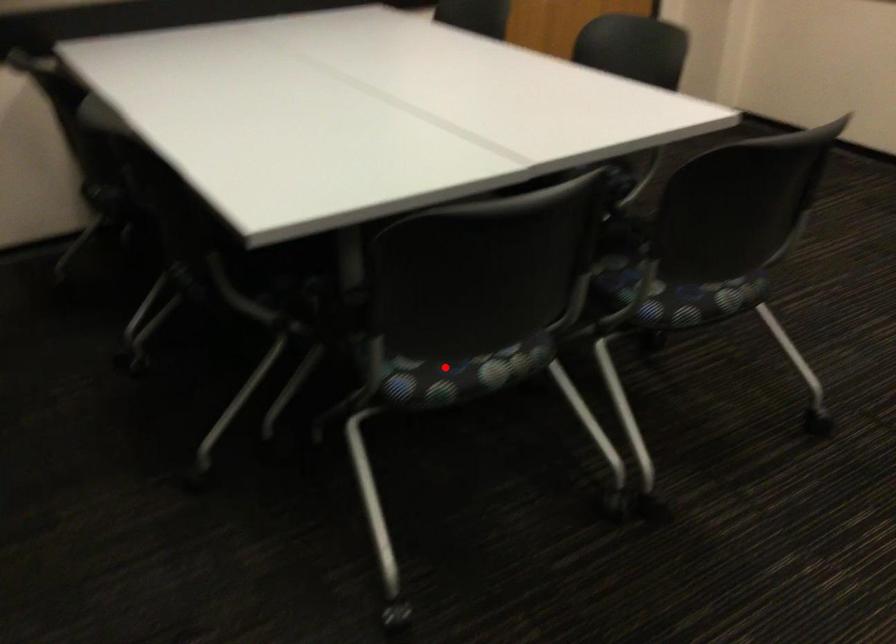
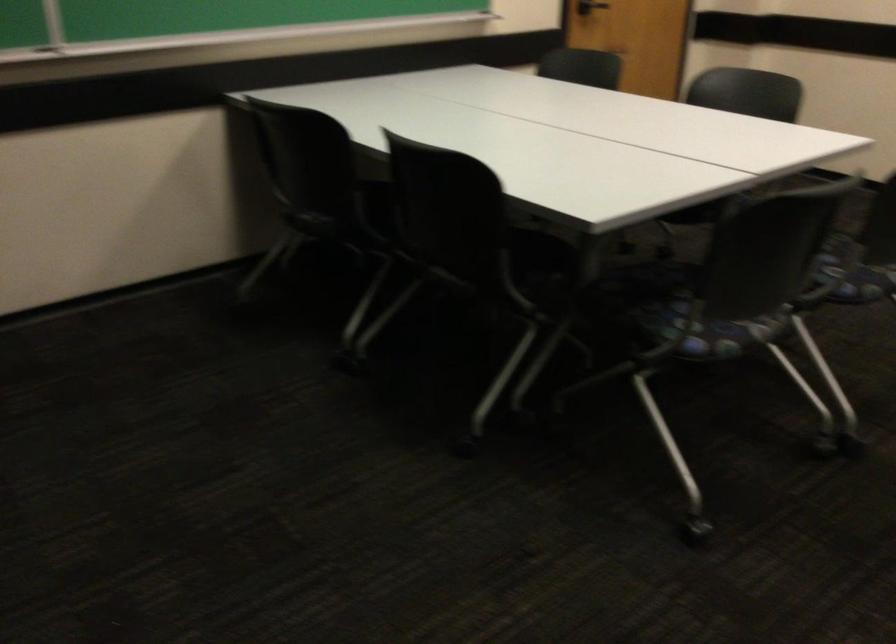
Question: I am providing you with two images of the same scene from different viewpoints. A red point is marked on the first image. Is the red point's position out of view in image 2?

Choices:
 (A) Yes
 (B) No

Answer: (B)